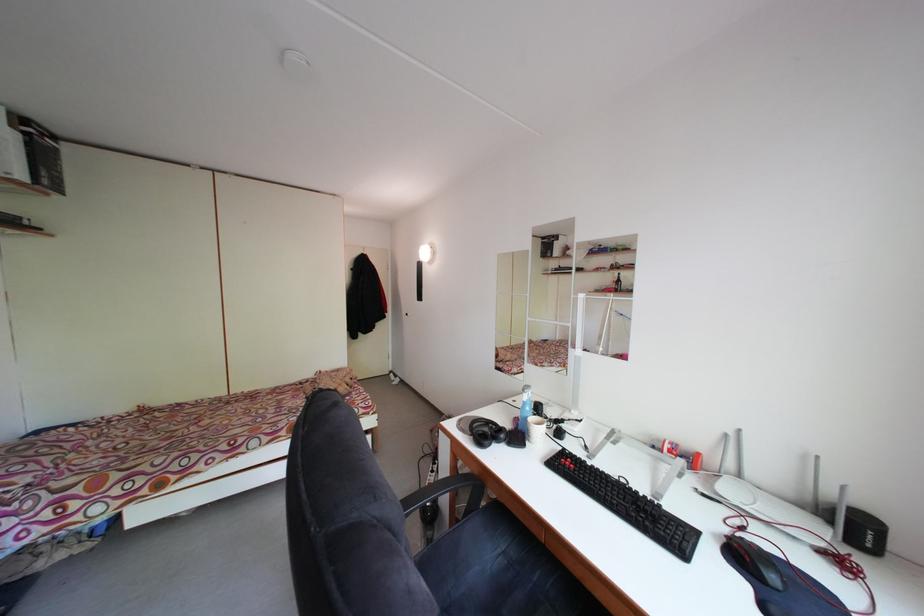
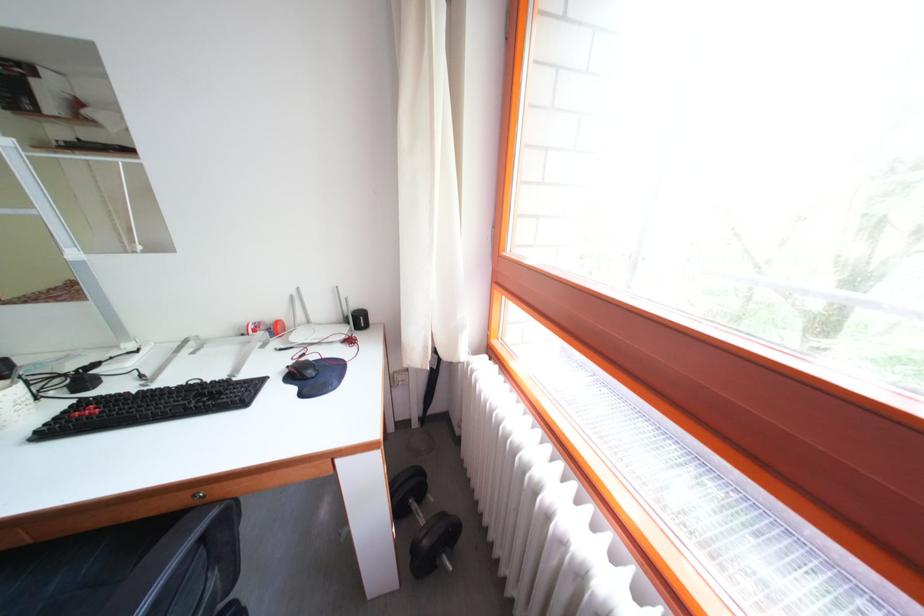
Find the pixel in the second image that matches [864,507] in the first image.

(365, 312)